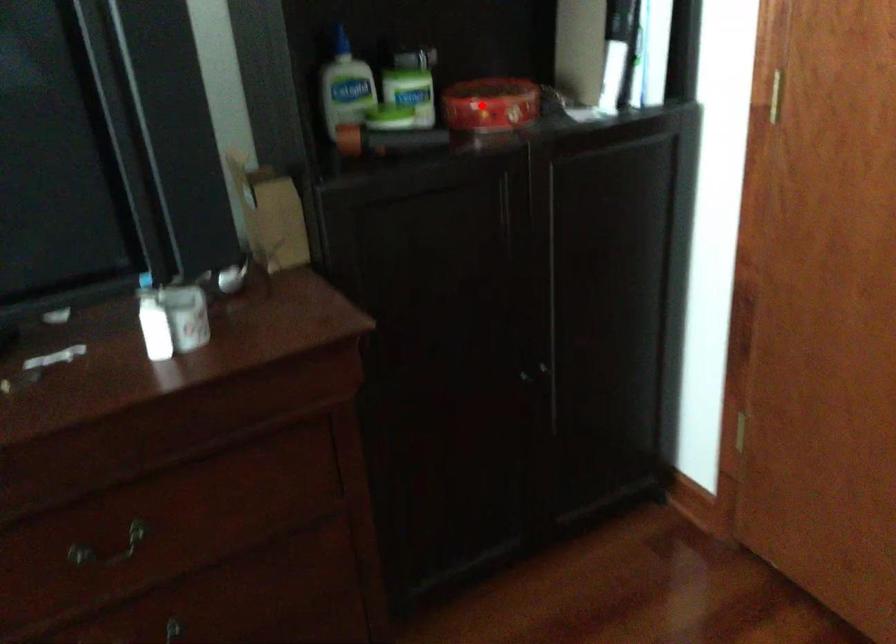
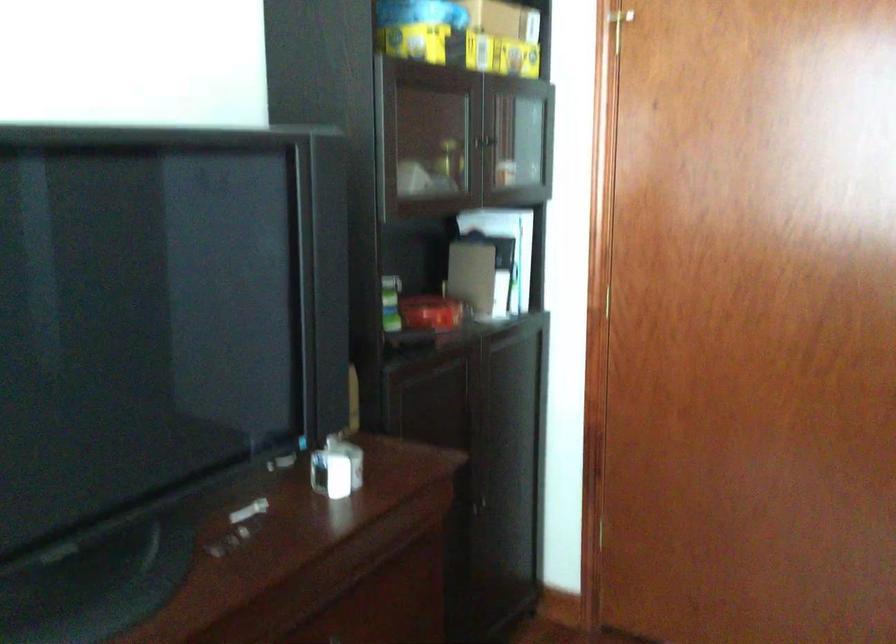
Find the pixel in the second image that matches the highlighted location in the first image.

(431, 313)